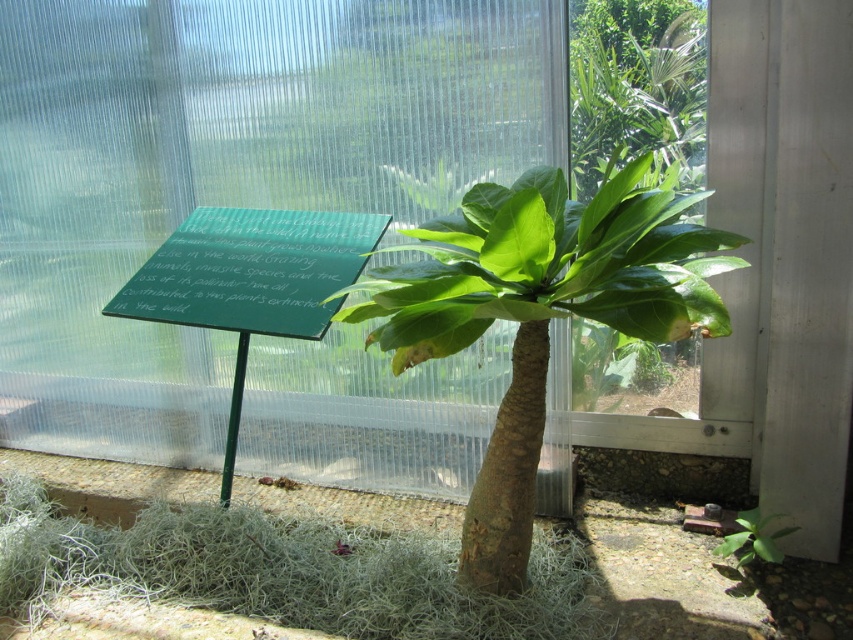
Question: Which of the following is the farthest from the observer?

Choices:
 (A) (405, 76)
 (B) (456, 214)

Answer: (A)

Question: Does green matte palm tree at center appear over green polished stone sign at center?

Choices:
 (A) yes
 (B) no

Answer: (B)

Question: Observing the image, what is the correct spatial positioning of green matte palm tree at center in reference to green polished stone sign at center?

Choices:
 (A) right
 (B) left

Answer: (A)

Question: Can you confirm if transparent plastic window at center is positioned above green polished stone sign at center?

Choices:
 (A) no
 (B) yes

Answer: (A)

Question: Among these points, which one is farthest from the camera?

Choices:
 (A) (608, 298)
 (B) (438, 285)

Answer: (A)

Question: Estimate the real-world distances between objects in this image. Which object is closer to the green matte palm tree at center?

Choices:
 (A) green polished stone sign at center
 (B) transparent plastic window at center

Answer: (A)